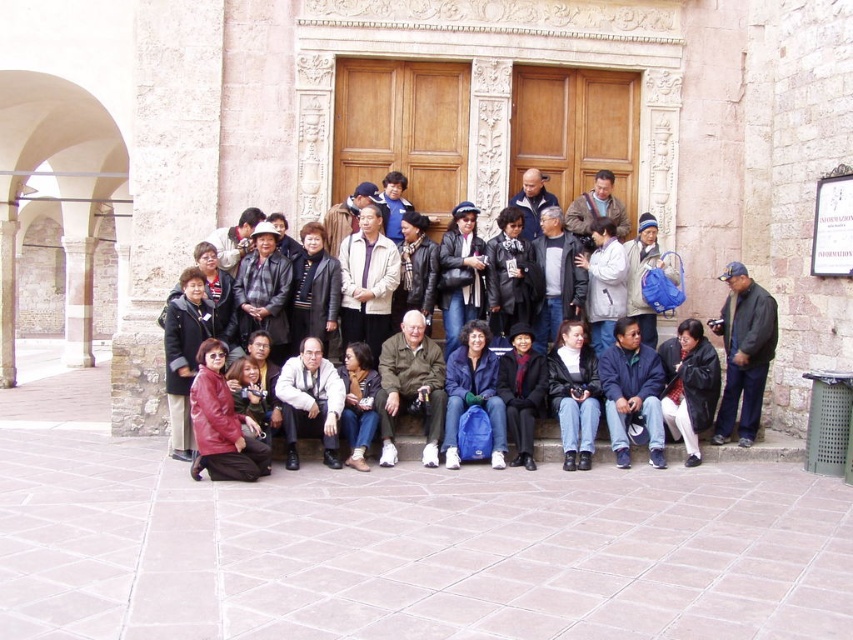
Question: Considering the relative positions of blue fabric jacket at center and light brown leather jacket at center in the image provided, where is blue fabric jacket at center located with respect to light brown leather jacket at center?

Choices:
 (A) right
 (B) left

Answer: (A)

Question: Among these points, which one is farthest from the camera?

Choices:
 (A) (437, 440)
 (B) (582, 333)
 (C) (486, 392)

Answer: (B)

Question: Which is farther from the matte black jacket at center?

Choices:
 (A) black leather jacket at lower center
 (B) blue fabric backpack at center
 (C) light brown leather jacket at center
 (D) khaki fabric jacket at center

Answer: (C)

Question: Which point appears closest to the camera in this image?

Choices:
 (A) (547, 440)
 (B) (683, 326)
 (C) (757, 362)

Answer: (A)

Question: Is blue fabric jacket at center to the right of blue fabric backpack at center from the viewer's perspective?

Choices:
 (A) no
 (B) yes

Answer: (B)

Question: Does light brown leather jacket at center appear on the left side of blue fabric backpack at center?

Choices:
 (A) yes
 (B) no

Answer: (A)